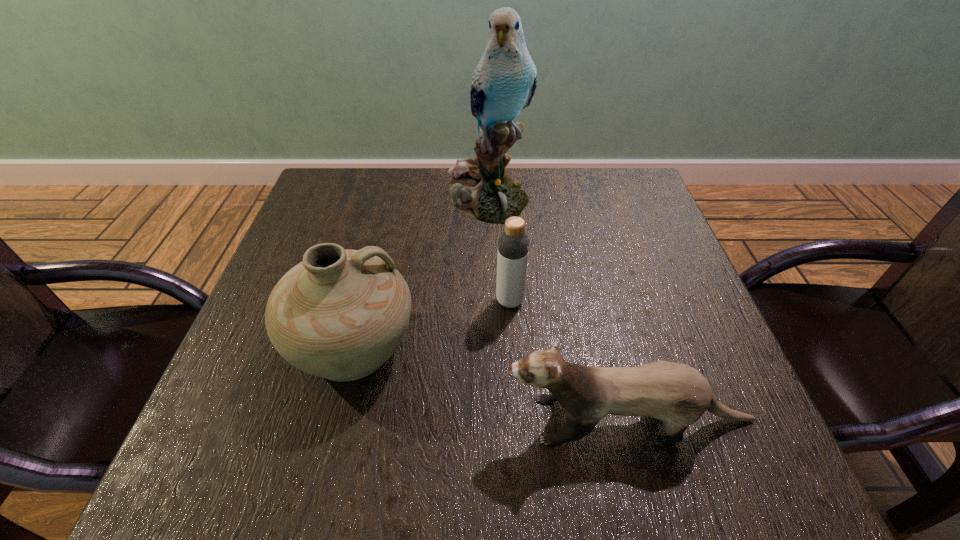
Image resolution: width=960 pixels, height=540 pixels. I want to click on free region located 0.230m on the face of the shortest object, so click(365, 420).

You are a GUI agent. You are given a task and a screenshot of the screen. Output one action in this format:
    pyautogui.click(x=<x>, y=<y>)
    Task: Click on the object at the far edge
    The image size is (960, 540).
    Given the screenshot: What is the action you would take?
    pyautogui.click(x=504, y=81)

This screenshot has width=960, height=540. I want to click on object located in the near edge section of the desktop, so click(677, 394).

Find the location of `object present at the left edge`. object present at the left edge is located at coordinates (340, 314).

At what (x,y) coordinates should I click in order to perform the action: click on object located in the right edge section of the desktop. Please return your answer as a coordinate pair (x, y). Looking at the image, I should click on (677, 394).

Identify the location of object located in the near right corner section of the desktop. (677, 394).

Image resolution: width=960 pixels, height=540 pixels. I want to click on blank area at the far edge, so (x=389, y=179).

Image resolution: width=960 pixels, height=540 pixels. In the image, there is a desktop. Identify the location of vacant space at the near edge. (520, 442).

Locate an element on the screen. This screenshot has width=960, height=540. vacant area at the left edge of the desktop is located at coordinates (228, 401).

Where is `vacant space at the right edge of the desktop`? The image size is (960, 540). vacant space at the right edge of the desktop is located at coordinates (673, 355).